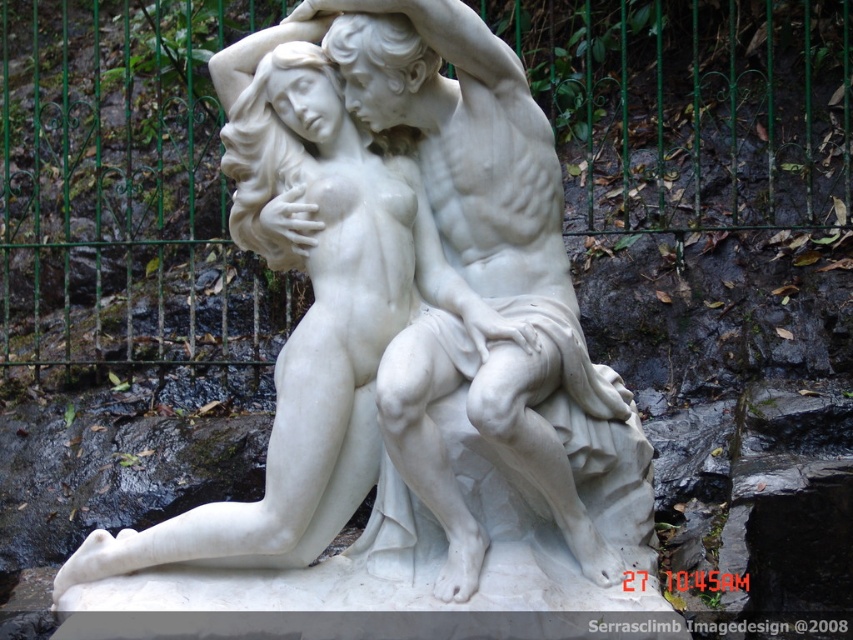
Is green metal fence at upper center positioned before white marble statue at center?

No, green metal fence at upper center is further to the viewer.

Which of these two, green metal fence at upper center or white marble statue at center, stands shorter?

white marble statue at center

In the scene shown: Who is more distant from viewer, (677,20) or (347,436)?

Positioned behind is point (677,20).

Locate an element on the screen. Image resolution: width=853 pixels, height=640 pixels. green metal fence at upper center is located at coordinates (122, 188).